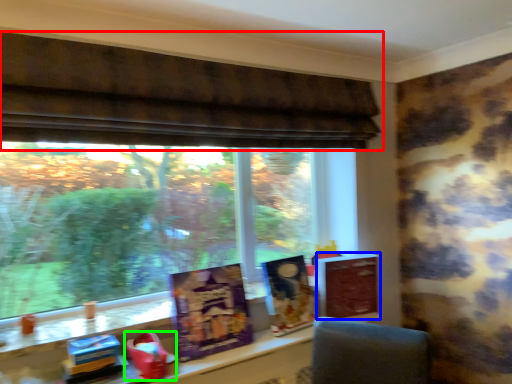
Question: Which object is the farthest from window (highlighted by a red box)? Choose among these: paperback book (highlighted by a blue box) or toy (highlighted by a green box).

Choices:
 (A) paperback book
 (B) toy

Answer: (B)